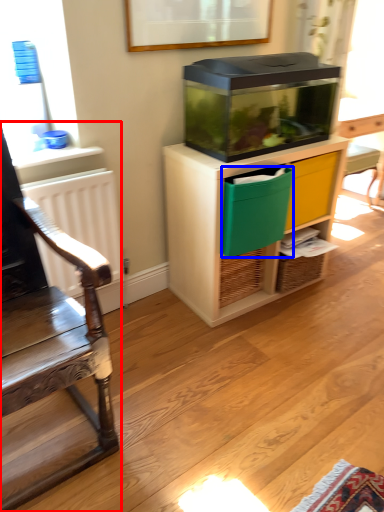
Question: Which of the following is the farthest to the observer, chair (highlighted by a red box) or crate (highlighted by a blue box)?

Choices:
 (A) chair
 (B) crate

Answer: (B)